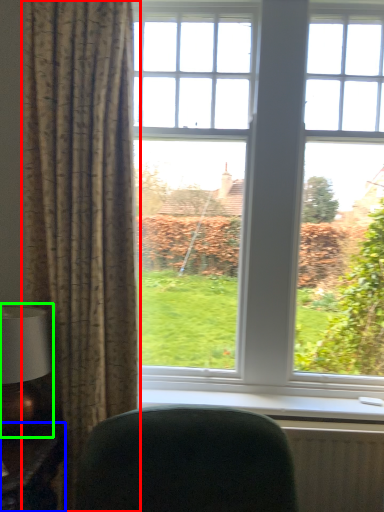
Question: Which object is the farthest from curtain (highlighted by a red box)? Choose among these: table (highlighted by a blue box) or table lamp (highlighted by a green box).

Choices:
 (A) table
 (B) table lamp

Answer: (A)